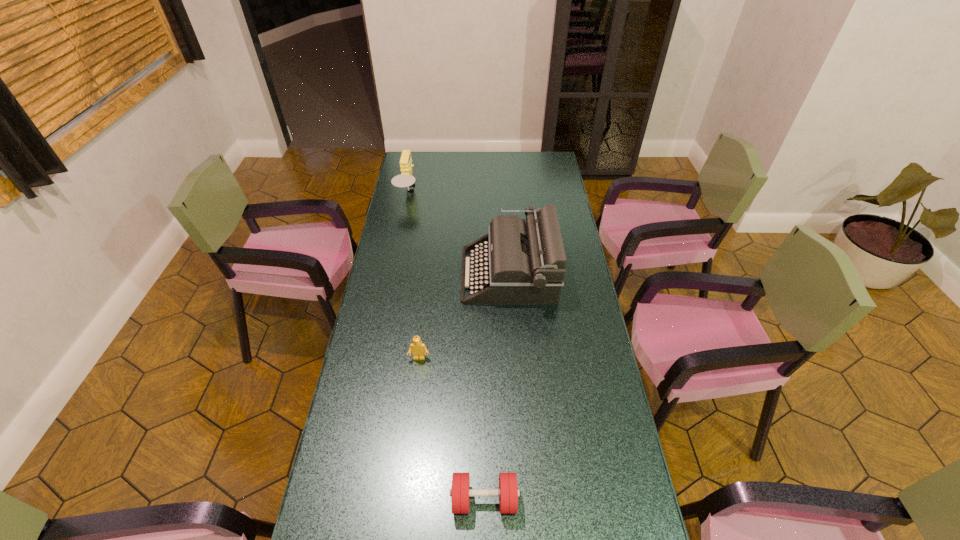
Where is `typewriter`? Image resolution: width=960 pixels, height=540 pixels. typewriter is located at coordinates (526, 262).

You are a GUI agent. You are given a task and a screenshot of the screen. Output one action in this format:
    pyautogui.click(x=<x>, y=<y>)
    Task: Click on the third nearest object
    The width and height of the screenshot is (960, 540).
    Given the screenshot: What is the action you would take?
    pyautogui.click(x=526, y=262)

Where is `the farthest object`? The height and width of the screenshot is (540, 960). the farthest object is located at coordinates (405, 179).

At what (x,y) coordinates should I click in order to perform the action: click on sponge. Please return your answer as a coordinate pair (x, y). Image resolution: width=960 pixels, height=540 pixels. Looking at the image, I should click on (405, 179).

Where is `the third farthest object`? the third farthest object is located at coordinates (417, 347).

Where is `Lego`? The width and height of the screenshot is (960, 540). Lego is located at coordinates (x=417, y=347).

Locate an element on the screen. This screenshot has width=960, height=540. dumbbell is located at coordinates (460, 492).

Locate an element on the screen. free space located 0.290m on the typing side of the tallest object is located at coordinates (390, 275).

You are a GUI agent. You are given a task and a screenshot of the screen. Output one action in this format:
    pyautogui.click(x=<x>, y=<y>)
    Task: Click on the vacant region located on the typing side of the tallest object
    This screenshot has width=960, height=540.
    Given the screenshot: What is the action you would take?
    pyautogui.click(x=390, y=275)

Find the location of `vacant space located 0.120m on the typing side of the tallest object`. vacant space located 0.120m on the typing side of the tallest object is located at coordinates (432, 275).